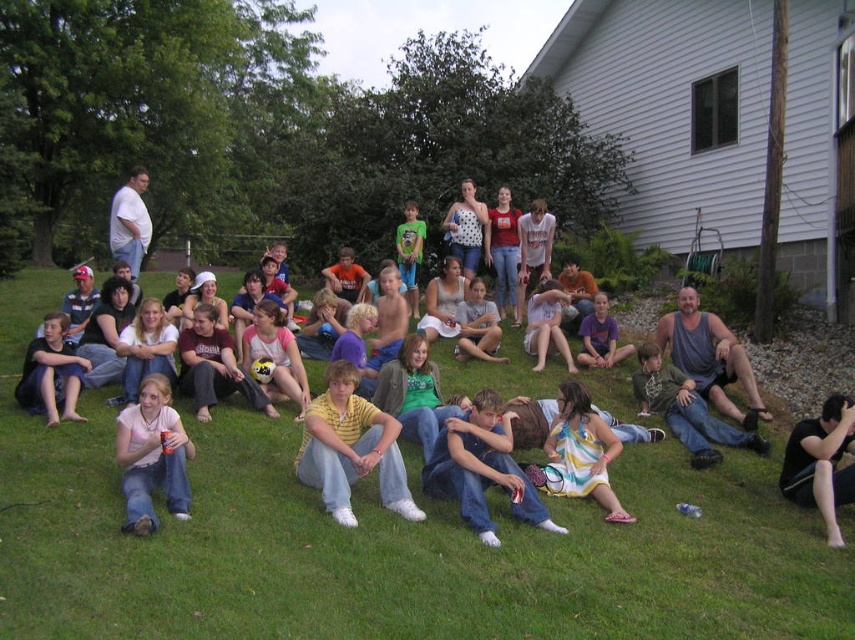
Question: Does green grass at center come behind light gray cotton shirt at center?

Choices:
 (A) yes
 (B) no

Answer: (B)

Question: Can you confirm if green grass at center is smaller than purple cotton shirt at center?

Choices:
 (A) yes
 (B) no

Answer: (B)

Question: Estimate the real-world distances between objects in this image. Which object is farther from the pink fabric shirt at lower left?

Choices:
 (A) gray tank top at center
 (B) white cotton shirt at upper left
 (C) purple cotton shirt at center

Answer: (A)

Question: Which point appears farthest from the camera in this image?

Choices:
 (A) (657, 339)
 (B) (143, 422)
 (C) (464, 388)
 (D) (492, 352)

Answer: (D)

Question: Is pink fabric shirt at lower left to the left of gray tank top at center from the viewer's perspective?

Choices:
 (A) yes
 (B) no

Answer: (A)

Question: Which object is closer to the camera taking this photo?

Choices:
 (A) green cotton shirt at center
 (B) green grass at center

Answer: (B)